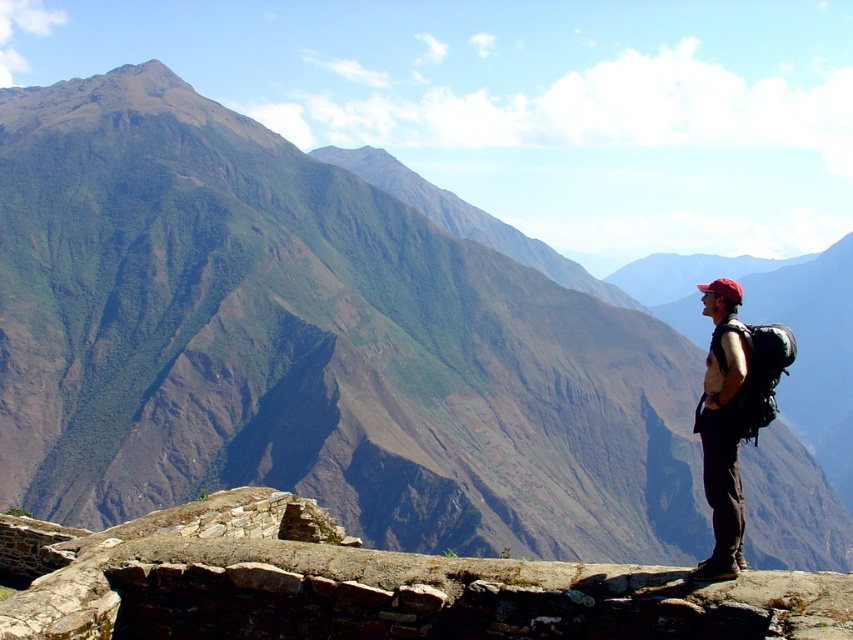
What do you see at coordinates (364, 586) in the screenshot? I see `rustic stone wall at center` at bounding box center [364, 586].

Is point (372, 604) positioned in front of point (724, 397)?

Yes, it is in front of point (724, 397).

I want to click on rustic stone wall at center, so click(364, 586).